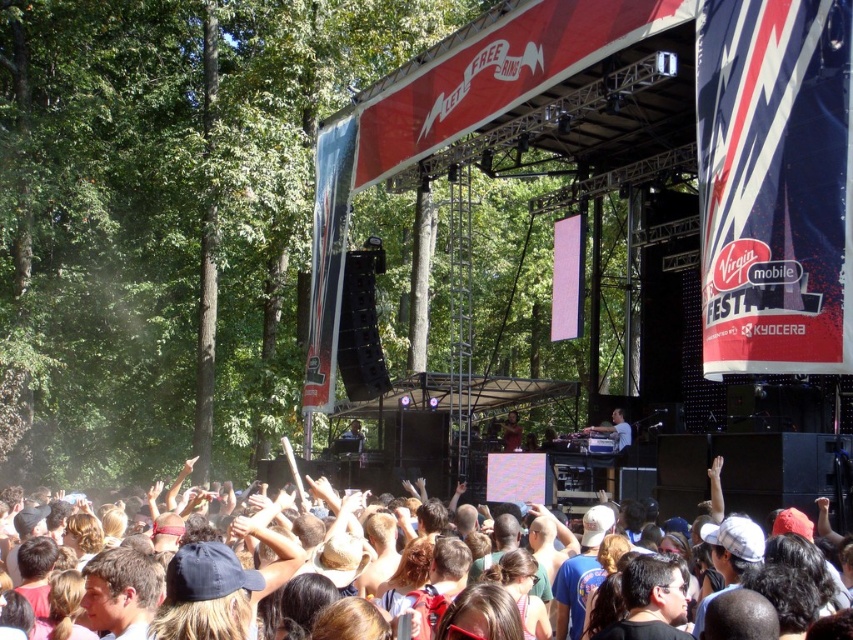
Based on the photo, which is above, multicolored fabric crowd at lower center or shiny black jacket at center?

shiny black jacket at center

Does point (827, 580) lie behind point (512, 426)?

No, (827, 580) is closer to viewer.

Describe the element at coordinates (323, 496) in the screenshot. I see `multicolored fabric crowd at lower center` at that location.

Locate an element on the screen. multicolored fabric crowd at lower center is located at coordinates (323, 496).

Does point (628, 438) come behind point (712, 474)?

Yes, point (628, 438) is farther from viewer.

Between point (625, 435) and point (798, 531), which one is positioned in front?

Point (798, 531)

I want to click on matte black dj booth at center, so click(x=614, y=429).

Who is positioned more to the left, matte black dj booth at center or shiny black jacket at center?

shiny black jacket at center is more to the left.

Is matte black dj booth at center behind shiny black jacket at center?

No, matte black dj booth at center is closer to the viewer.

Which is behind, point (621, 429) or point (514, 435)?

Positioned behind is point (514, 435).

Locate an element on the screen. The image size is (853, 640). matte black dj booth at center is located at coordinates (614, 429).